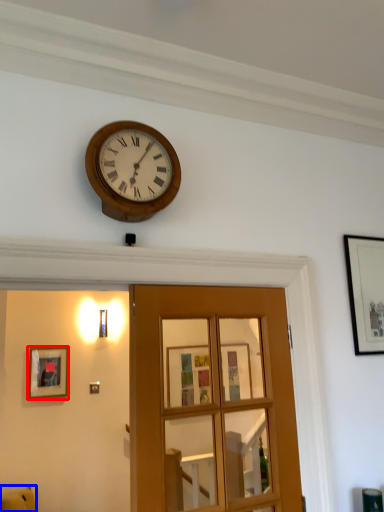
Question: Which point is further to the camera, picture frame (highlighted by a red box) or furniture (highlighted by a blue box)?

Choices:
 (A) picture frame
 (B) furniture

Answer: (A)